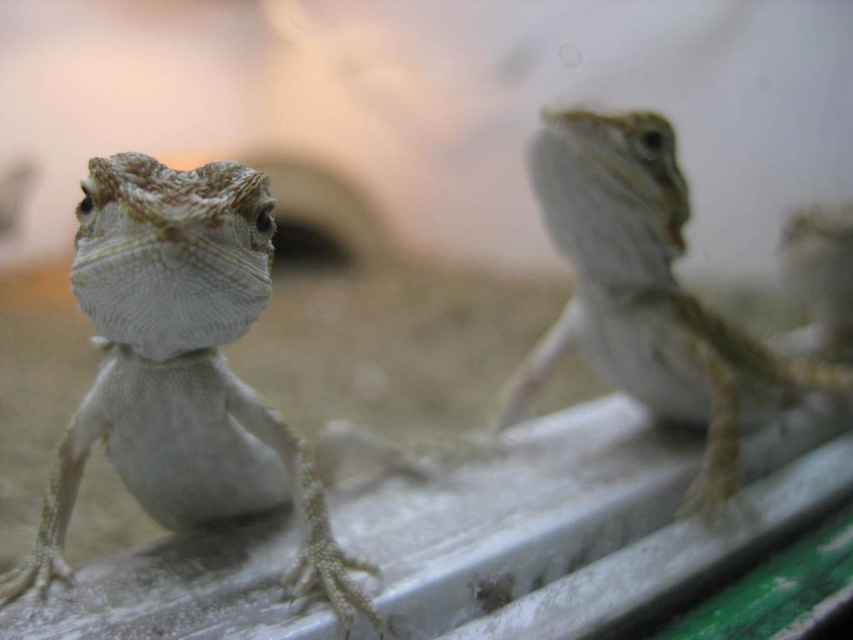
You are a researcher observing two lizards on a white surface. You notice a point marked at coordinates (183,369). Which lizard is closest to this point? The lizards are the textured skin lizard with beige, brown, and white patterns on the left and the motion blurred lizard with lighter tones on the right.

The point marked at (183,369) is closest to the smooth beige lizard at center, which is the textured skin lizard with beige, brown, and white patterns on the left.

You are a biologist observing two lizards in a terrarium. You notice a smooth beige lizard at center and a smooth beige lizard at upper right. Which lizard takes up more space in the image?

The smooth beige lizard at upper right takes up more space in the image than the smooth beige lizard at center.

You are a researcher observing two points in an enclosure. The points are labeled as point (138, 486) and point (705, 356). Based on their positions, which point is nearer to you?

Point (138, 486) is closer to the viewer than point (705, 356).